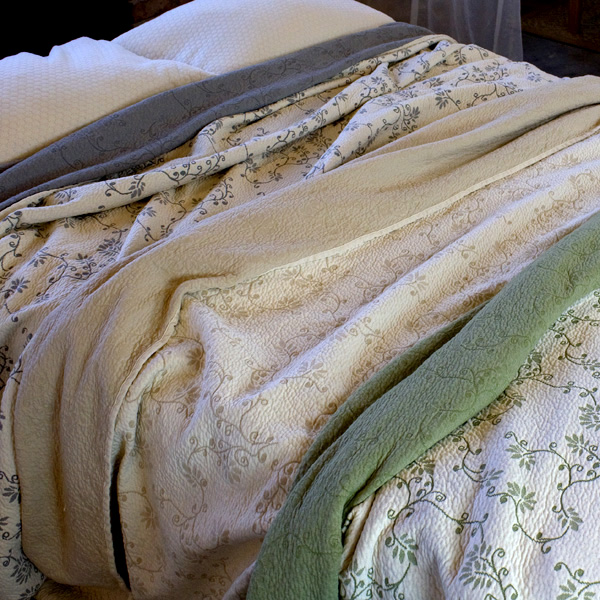
Where is `blanket`? The height and width of the screenshot is (600, 600). blanket is located at coordinates (479, 386), (337, 278), (229, 153), (184, 117).